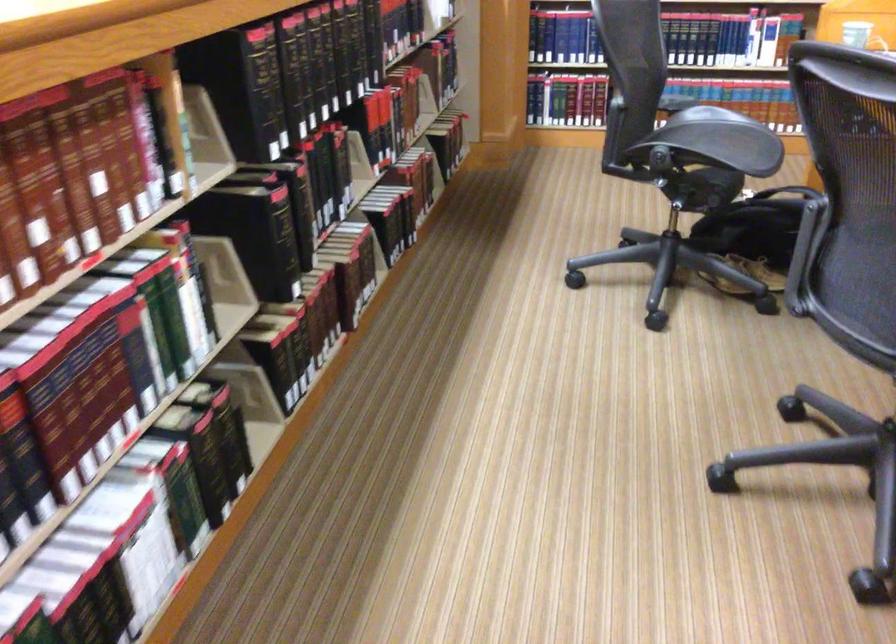
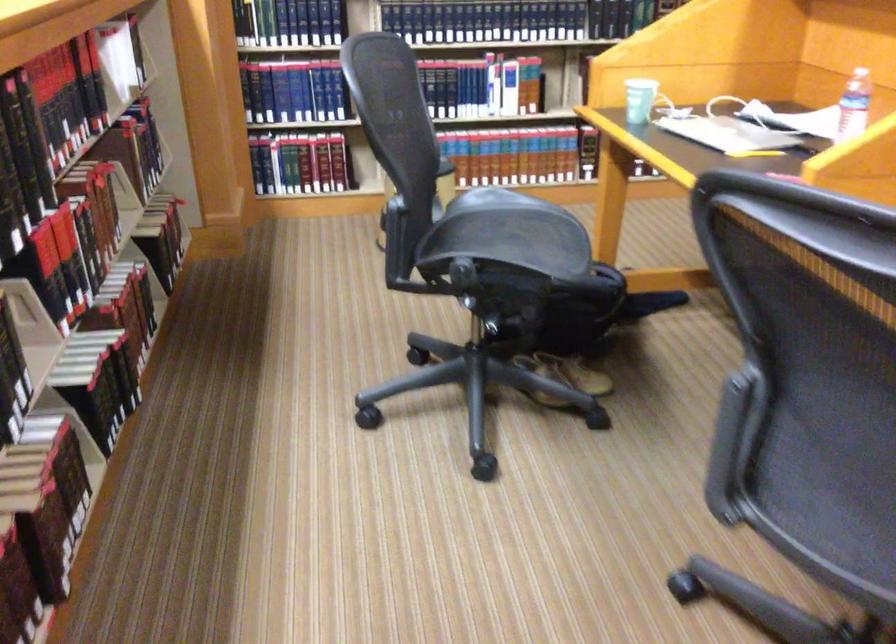
Find the pixel in the second image that matches (x=642, y=158) in the first image.

(433, 272)